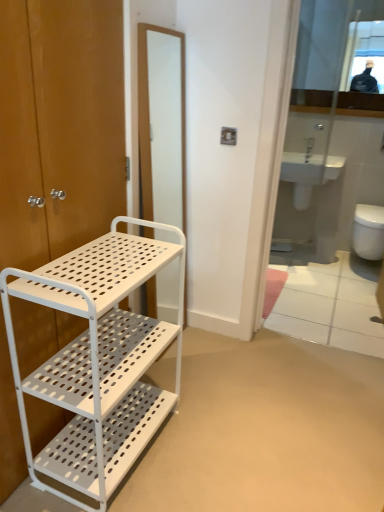
Where is `empty space that is to the right of white perforated metal shelf at left`? Image resolution: width=384 pixels, height=512 pixels. empty space that is to the right of white perforated metal shelf at left is located at coordinates (211, 445).